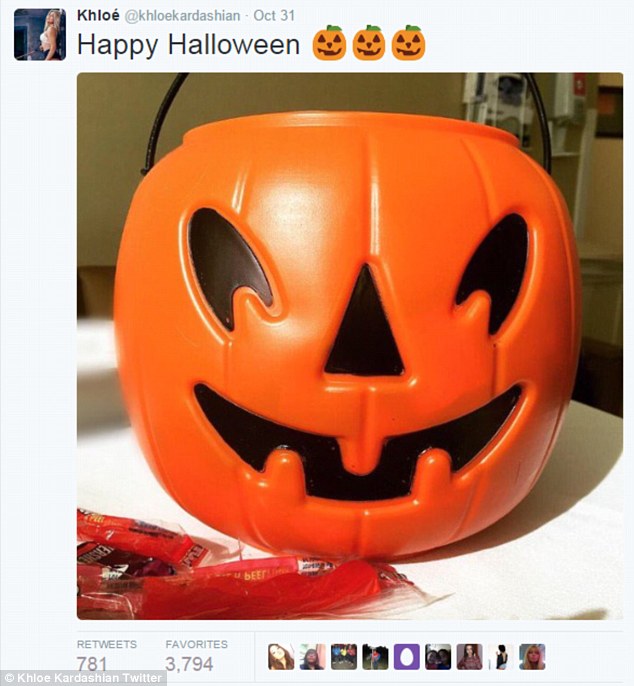
This screenshot has width=634, height=686. I want to click on off white wall, so click(x=117, y=129).